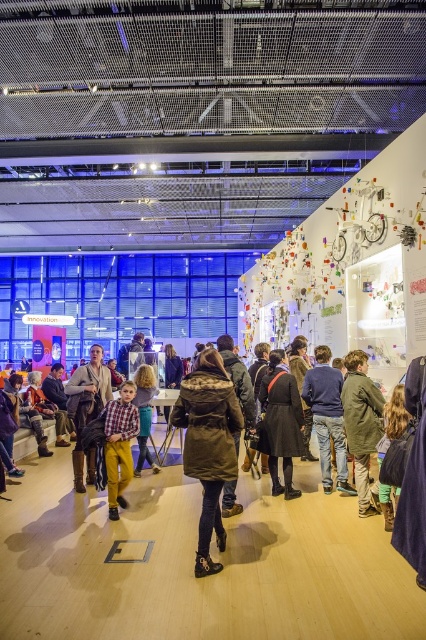
You are an artist planning to hang a large painting between the green textured jacket at lower right and the dark blue sweater at center. Which object should you avoid placing the painting in front of to ensure it doesn

You should avoid placing the painting in front of the green textured jacket at lower right because it is shorter than the dark blue sweater at center, so the painting might be partially obscured if placed there.

Consider the image. You are a visitor in this exhibition space and you see the green textured jacket at lower right and the dark blue sweater at center. Which one is placed higher on the display?

The green textured jacket at lower right is positioned over the dark blue sweater at center, so it is placed higher.

You are an artist planning to paint a scene of this exhibition space. You want to ensure the sizes of the green textured jacket at lower right and the dark blue sweater at center are accurate. Which object should you paint as the smaller one?

The green textured jacket at lower right should be painted as the smaller one since it is smaller than the dark blue sweater at center according to the description.